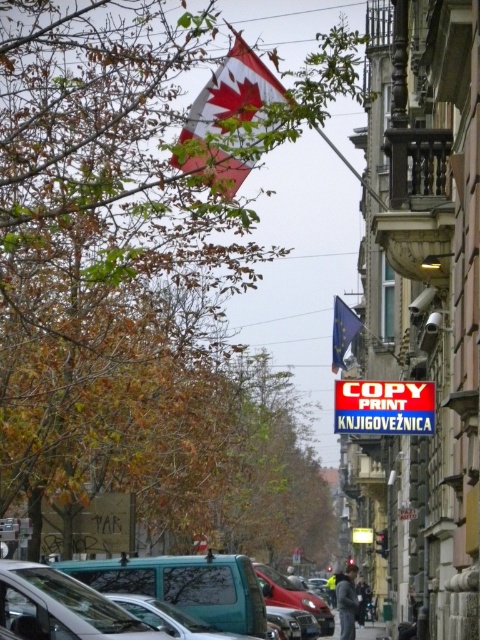
Question: Which point appears closest to the camera in this image?

Choices:
 (A) click(x=262, y=106)
 (B) click(x=347, y=586)
 (C) click(x=288, y=584)

Answer: (A)

Question: Can you confirm if red plastic sign at center is positioned to the right of blue fabric flag at center?

Choices:
 (A) yes
 (B) no

Answer: (B)

Question: Does red and white fabric flag at upper center appear on the left side of matte red car at center?

Choices:
 (A) yes
 (B) no

Answer: (A)

Question: Which object is farther from the camera taking this photo?

Choices:
 (A) red plastic sign at center
 (B) dark gray jacket at center
 (C) red and white fabric flag at upper center
 (D) gray concrete pavement at lower center

Answer: (D)

Question: Is red plastic sign at center positioned behind dark gray fabric jacket at center?

Choices:
 (A) no
 (B) yes

Answer: (A)

Question: Which of these objects is positioned closest to the dark gray jacket at center?

Choices:
 (A) matte red car at center
 (B) red plastic sign at center
 (C) gray concrete pavement at lower center

Answer: (A)